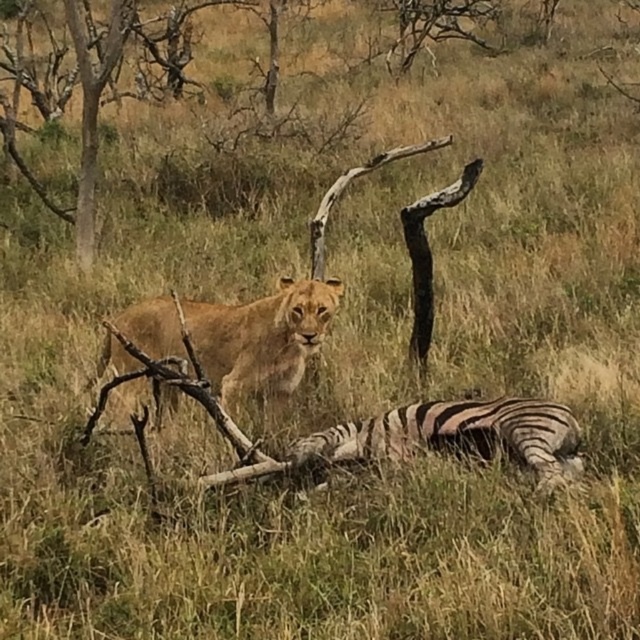
You are a safari guide explaining the scene to tourists. Point out the positions of the golden fur lion at center and the black and white striped zebra at lower center. Which animal is higher up in the image?

The golden fur lion at center is above the black and white striped zebra at lower center, so the lion is higher up in the image.

You are a safari guide leading a tour. You need to inform your guests about the animals in the image. Which animal is bigger between the golden fur lion at center and the black and white striped zebra at lower center?

The golden fur lion at center is larger in size than the black and white striped zebra at lower center.